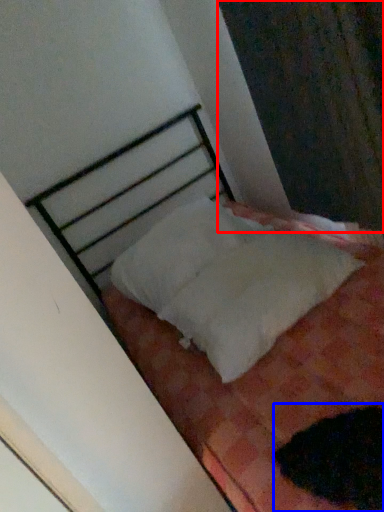
Question: Which object appears farthest to the camera in this image, curtain (highlighted by a red box) or animal (highlighted by a blue box)?

Choices:
 (A) curtain
 (B) animal

Answer: (A)